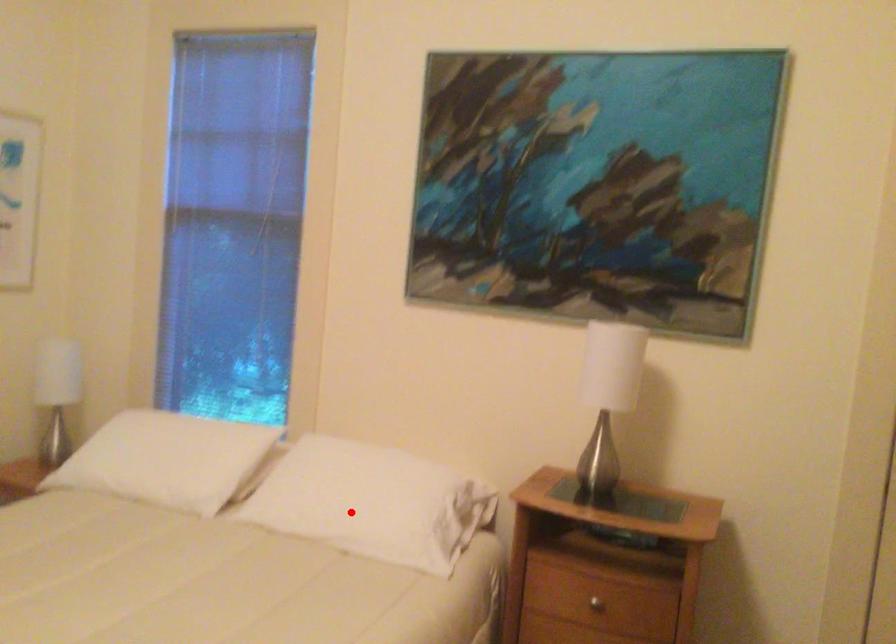
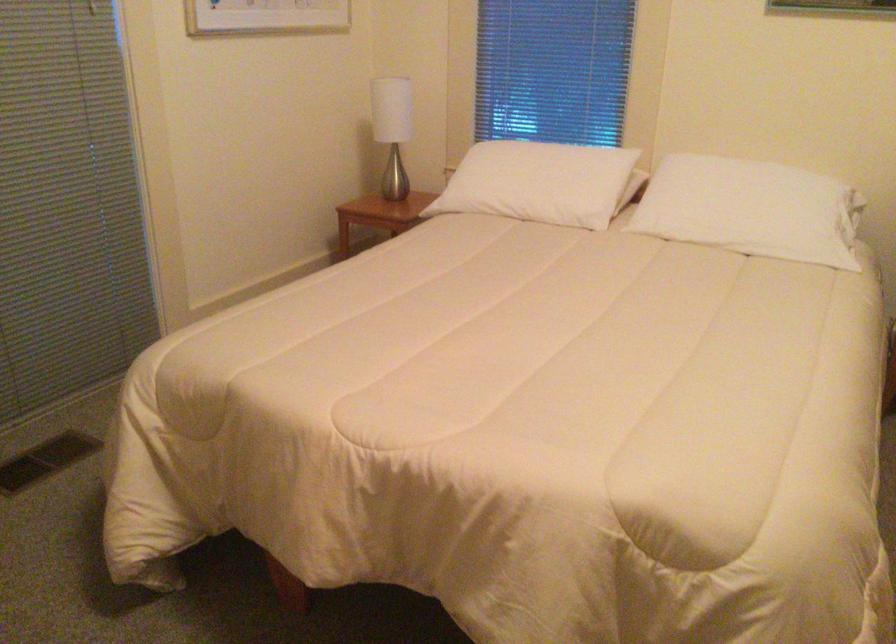
Where in the second image is the point corresponding to the highlighted location from the first image?

(752, 210)